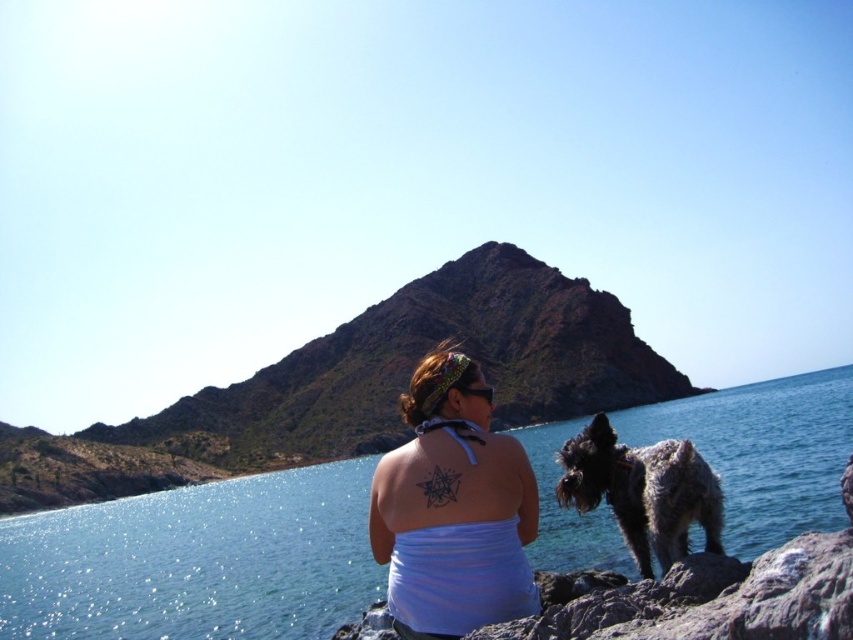
Question: Which point appears closest to the camera in this image?

Choices:
 (A) (730, 468)
 (B) (646, 445)
 (C) (433, 429)

Answer: (C)

Question: Can you confirm if blue liquid water at center is smaller than spotted fur dog at lower right?

Choices:
 (A) no
 (B) yes

Answer: (A)

Question: Can you confirm if white matte tank top at center is thinner than spotted fur dog at lower right?

Choices:
 (A) yes
 (B) no

Answer: (B)

Question: Which object appears farthest from the camera in this image?

Choices:
 (A) blue liquid water at center
 (B) white matte tank top at center
 (C) spotted fur dog at lower right

Answer: (A)

Question: Among these points, which one is nearest to the camera?

Choices:
 (A) (780, 502)
 (B) (679, 472)
 (C) (445, 364)

Answer: (B)

Question: In this image, where is white matte tank top at center located relative to spotted fur dog at lower right?

Choices:
 (A) right
 (B) left

Answer: (B)